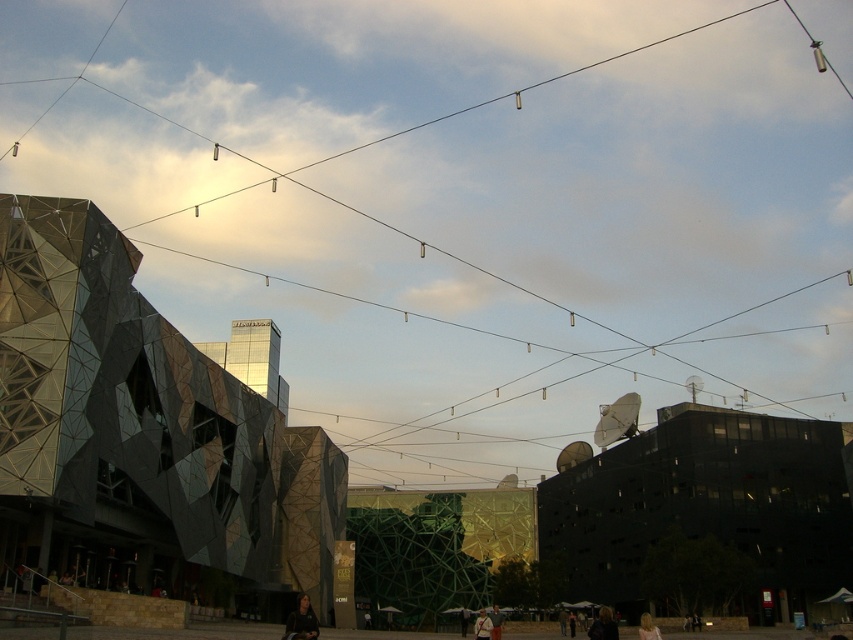
Question: Which object is closer to the camera taking this photo?

Choices:
 (A) light brown leather jacket at center
 (B) metallic glass building at left

Answer: (B)

Question: Considering the relative positions of dark glass building at center and light brown leather jacket at center in the image provided, where is dark glass building at center located with respect to light brown leather jacket at center?

Choices:
 (A) below
 (B) above

Answer: (B)

Question: Is dark brown leather jacket at lower center bigger than dark brown leather jacket at lower right?

Choices:
 (A) no
 (B) yes

Answer: (B)

Question: Among these objects, which one is nearest to the camera?

Choices:
 (A) dark brown leather jacket at lower center
 (B) blonde hair at lower right
 (C) metallic glass building at left

Answer: (A)

Question: Which of the following is the closest to the observer?

Choices:
 (A) (645, 628)
 (B) (480, 636)
 (C) (492, 628)
 (D) (599, 625)

Answer: (A)

Question: Is dark brown leather jacket at lower center below dark gray sweater at center?

Choices:
 (A) yes
 (B) no

Answer: (B)